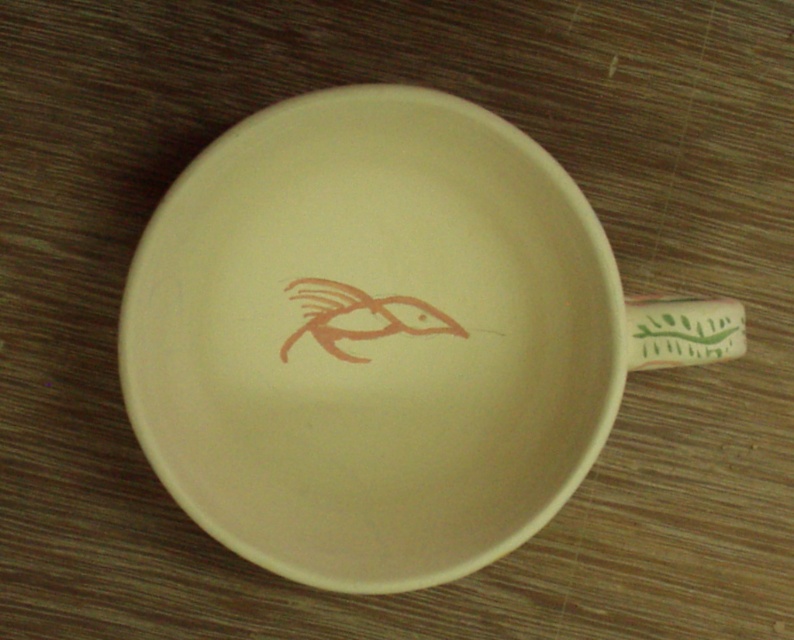
Between matte ceramic saucer at center and green leafy design at right, which one is positioned lower?

matte ceramic saucer at center is below.

Between matte ceramic saucer at center and green leafy design at right, which one appears on the left side from the viewer's perspective?

matte ceramic saucer at center is more to the left.

Is point (480, 547) positioned before point (629, 349)?

Yes, it is.

Locate an element on the screen. Image resolution: width=794 pixels, height=640 pixels. matte ceramic saucer at center is located at coordinates (372, 339).